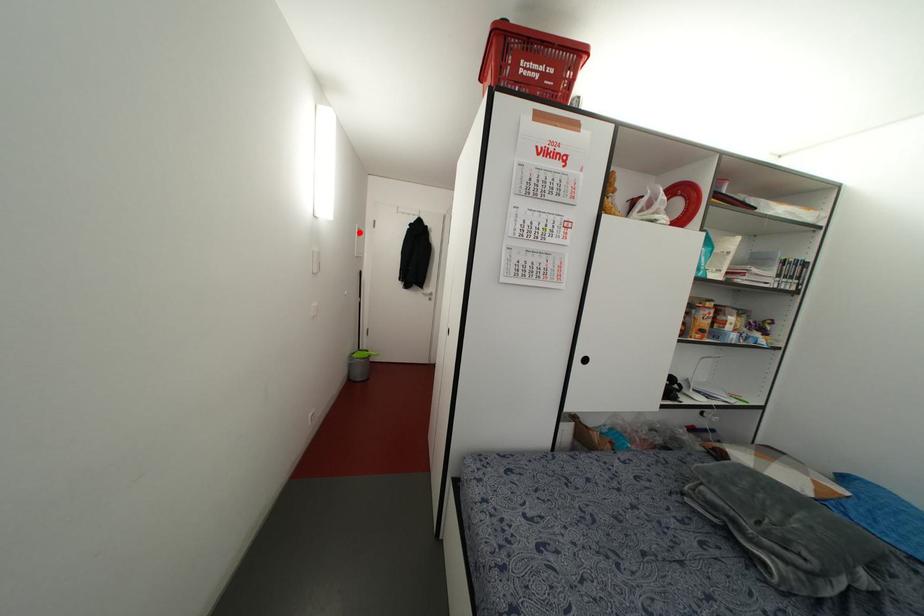
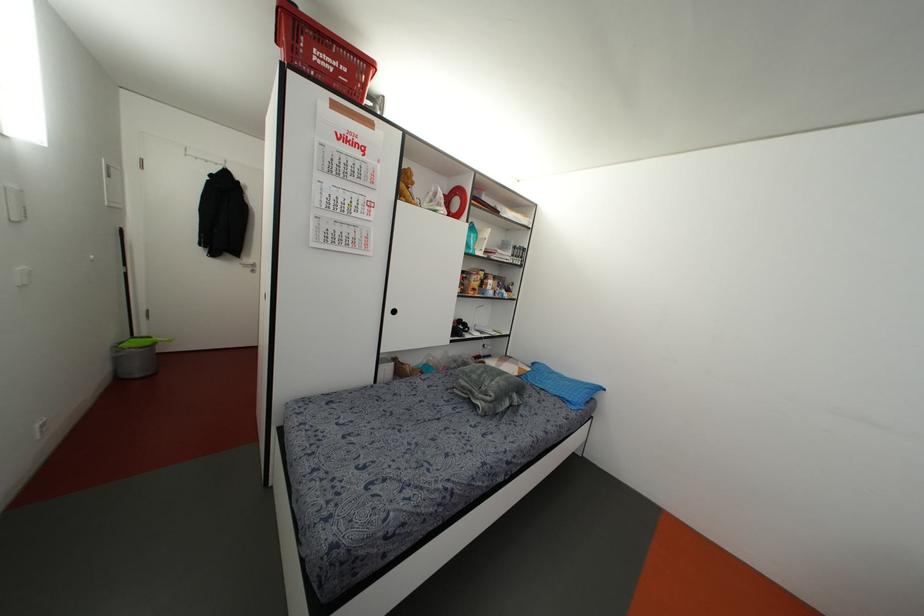
In the second image, find the point that corresponds to the highlighted location in the first image.

(112, 172)